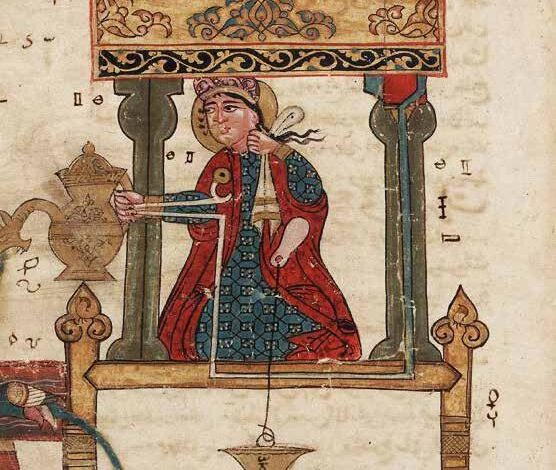
The image size is (556, 470). In order to click on spout of cofee pot in this screenshot , I will do click(x=32, y=206).